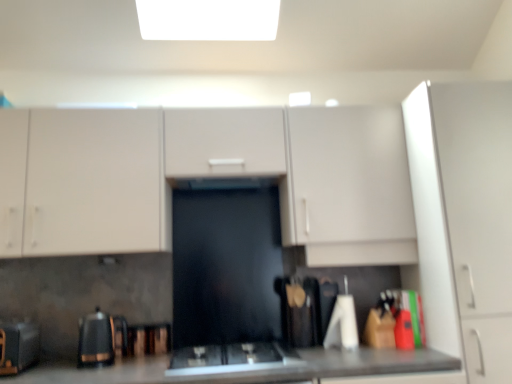
Question: From a real-world perspective, is black glossy kettle at lower left, the second appliance when ordered from right to left, positioned above or below wooden spatula at center, the 3th appliance from the left?

Choices:
 (A) below
 (B) above

Answer: (A)

Question: Considering the positions of black glossy kettle at lower left, the second appliance when ordered from right to left, and wooden spatula at center, the 3th appliance from the left, in the image, is black glossy kettle at lower left, the second appliance when ordered from right to left, wider or thinner than wooden spatula at center, the 3th appliance from the left,?

Choices:
 (A) wide
 (B) thin

Answer: (B)

Question: Which is nearer to the matte white cabinets at center, acting as the 1th cabinetry starting from the left?

Choices:
 (A) black glass gas stove at center
 (B) black matte toaster at lower left, which is counted as the third appliance, starting from the right
 (C) black glossy kettle at lower left, the second appliance when ordered from right to left
 (D) white matte cabinet at right, which is the second cabinetry from left to right
 (E) wooden spatula at center, the 3th appliance from the left

Answer: (E)

Question: Which of these objects is positioned farthest from the matte white cabinets at center, acting as the 1th cabinetry starting from the left?

Choices:
 (A) black glass gas stove at center
 (B) black glossy kettle at lower left, the second appliance when ordered from right to left
 (C) black matte toaster at lower left, which is counted as the third appliance, starting from the right
 (D) white matte cabinet at right, positioned as the 1th cabinetry in right-to-left order
 (E) wooden spatula at center, which ranks as the 1th appliance in right-to-left order

Answer: (C)